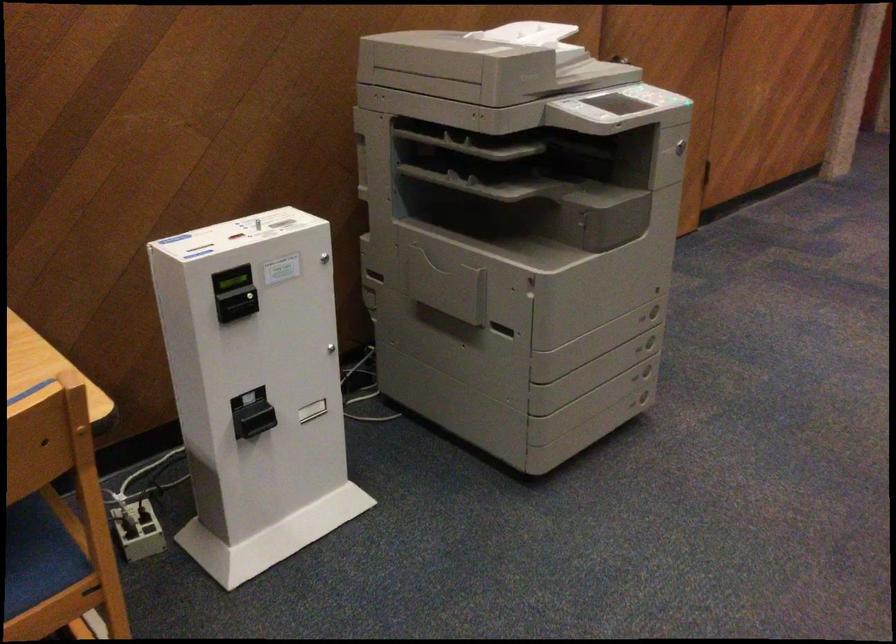
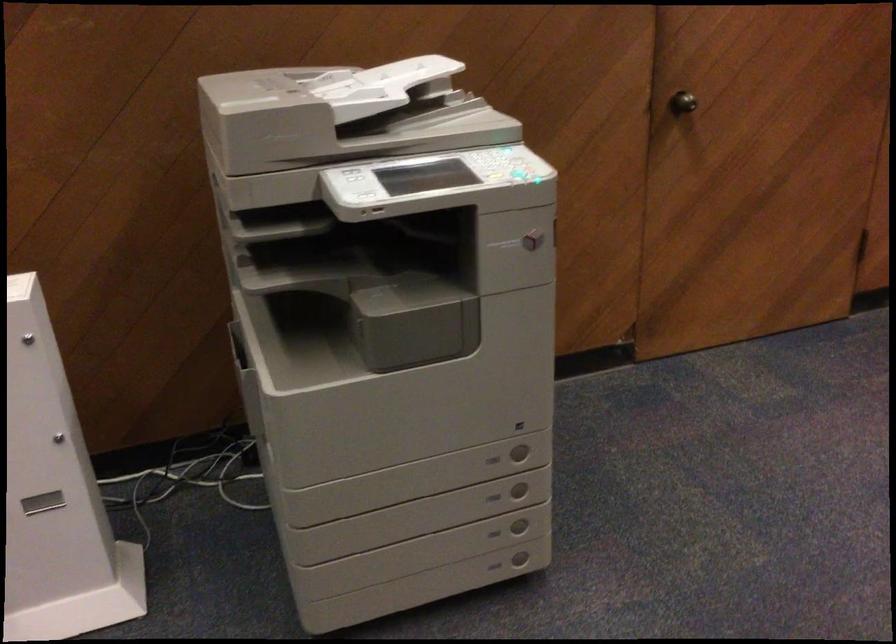
Which direction would the cameraman need to move to produce the second image?

The cameraman walked toward right, forward.